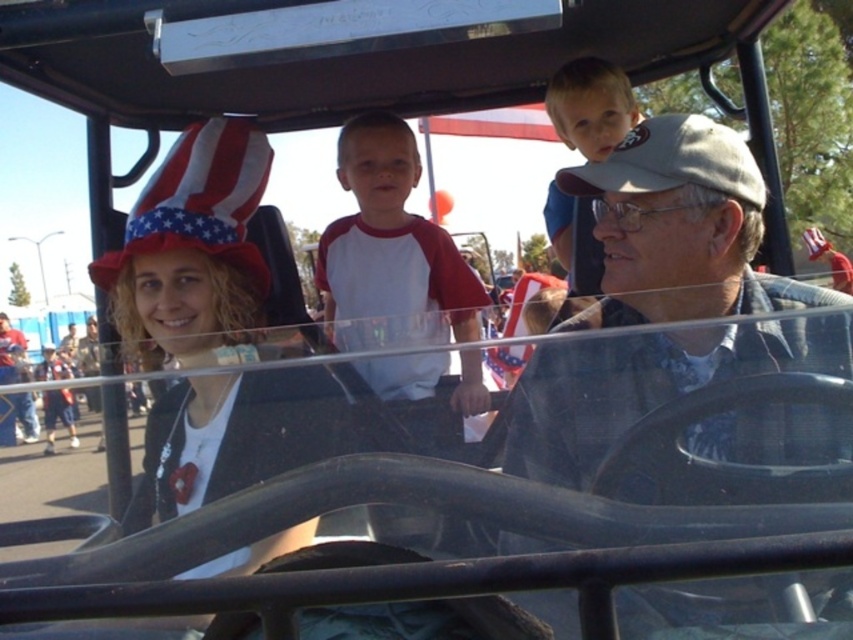
Which of these two, blue denim shirt at center or white/red raglan shirt at center, stands taller?

blue denim shirt at center

Is blue denim shirt at center shorter than white/red raglan shirt at center?

No.

Is point (840, 596) in front of point (440, 292)?

Yes.

The image size is (853, 640). What are the coordinates of `blue denim shirt at center` in the screenshot? It's located at (682, 225).

Looking at this image, is blue denim shirt at center shorter than light brown hair at upper center?

No.

Does blue denim shirt at center have a greater height compared to light brown hair at upper center?

Yes.

Between point (671, 188) and point (602, 115), which one is positioned behind?

Point (602, 115)

The width and height of the screenshot is (853, 640). I want to click on blue denim shirt at center, so click(682, 225).

Between white/red raglan shirt at center and matte white shirt at center, which one appears on the left side from the viewer's perspective?

Positioned to the left is matte white shirt at center.

Who is more distant from viewer, (447, 288) or (25, 324)?

The point (25, 324) is more distant.

The width and height of the screenshot is (853, 640). What do you see at coordinates (378, 168) in the screenshot? I see `white/red raglan shirt at center` at bounding box center [378, 168].

I want to click on white/red raglan shirt at center, so pos(378,168).